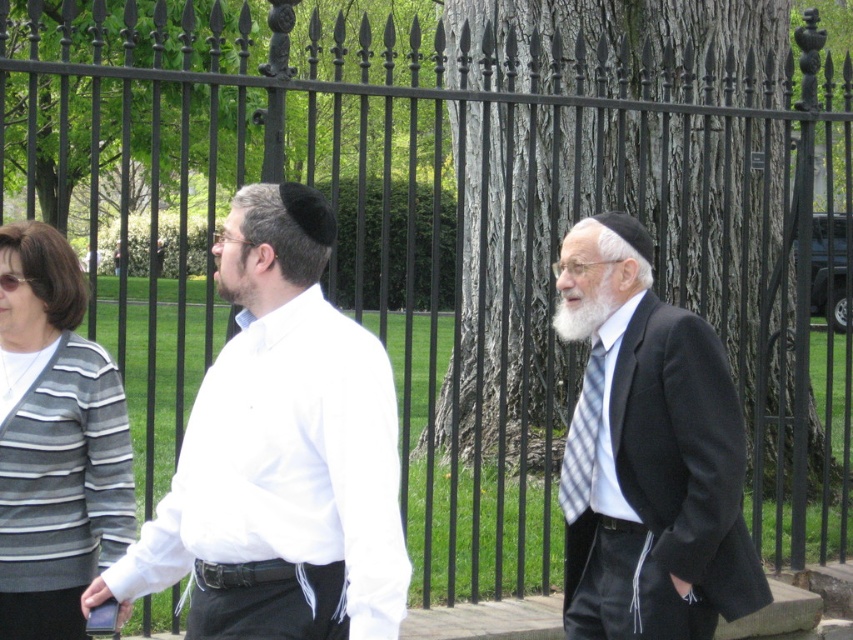
Does white matte shirt at center appear on the right side of striped knit cardigan at left?

Indeed, white matte shirt at center is positioned on the right side of striped knit cardigan at left.

Which is more to the left, white matte shirt at center or striped knit cardigan at left?

striped knit cardigan at left is more to the left.

Image resolution: width=853 pixels, height=640 pixels. I want to click on white matte shirt at center, so click(280, 452).

Locate an element on the screen. The width and height of the screenshot is (853, 640). white matte shirt at center is located at coordinates (280, 452).

Which is above, black wool suit at right or whitehairbeard at center?

whitehairbeard at center is above.

Is black wool suit at right further to the viewer compared to whitehairbeard at center?

No, it is in front of whitehairbeard at center.

Find the location of a particular element. Image resolution: width=853 pixels, height=640 pixels. black wool suit at right is located at coordinates (647, 454).

Measure the distance between white matte shirt at center and black wool suit at right.

The distance of white matte shirt at center from black wool suit at right is 3.59 feet.

Is white matte shirt at center behind black wool suit at right?

That is False.

Locate an element on the screen. The height and width of the screenshot is (640, 853). white matte shirt at center is located at coordinates (280, 452).